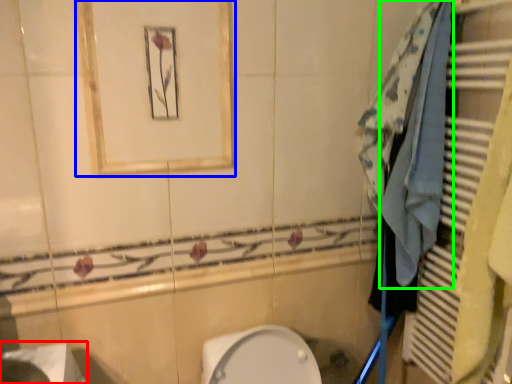
Question: Based on their relative distances, which object is nearer to sink (highlighted by a red box)? Choose from medicine cabinet (highlighted by a blue box) and bath towel (highlighted by a green box).

Choices:
 (A) medicine cabinet
 (B) bath towel

Answer: (A)